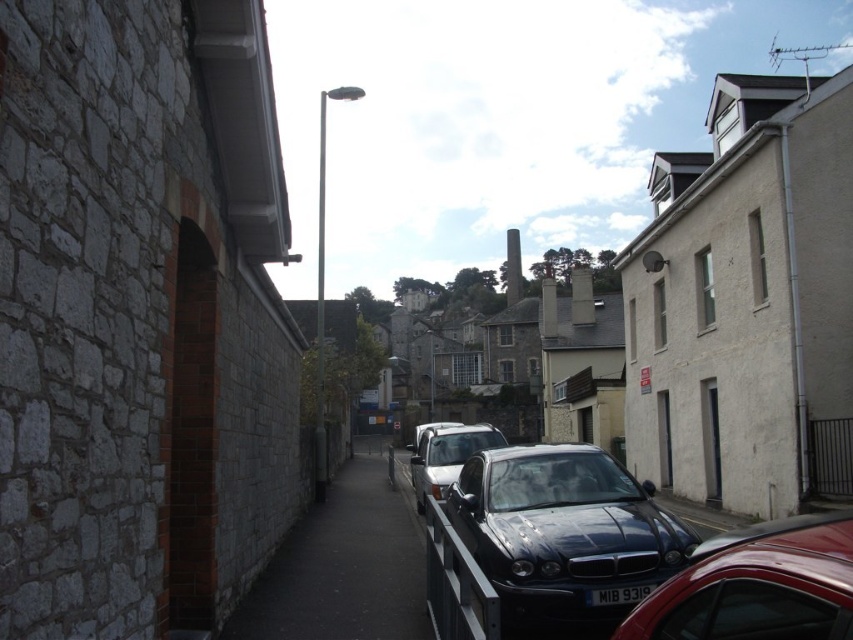
Does black glossy car at center have a greater height compared to metallic silver car at center?

Incorrect, black glossy car at center's height is not larger of metallic silver car at center's.

Is black glossy car at center thinner than metallic silver car at center?

Yes.

What do you see at coordinates (561, 531) in the screenshot? I see `black glossy car at center` at bounding box center [561, 531].

This screenshot has width=853, height=640. I want to click on black glossy car at center, so click(561, 531).

This screenshot has height=640, width=853. Identify the location of glossy black car at center. (757, 586).

I want to click on glossy black car at center, so click(757, 586).

Is black glossy car at center positioned at the back of glossy black car at center?

Yes, black glossy car at center is behind glossy black car at center.

Between black glossy car at center and glossy black car at center, which one is positioned higher?

glossy black car at center

What do you see at coordinates (561, 531) in the screenshot? Image resolution: width=853 pixels, height=640 pixels. I see `black glossy car at center` at bounding box center [561, 531].

I want to click on black glossy car at center, so click(x=561, y=531).